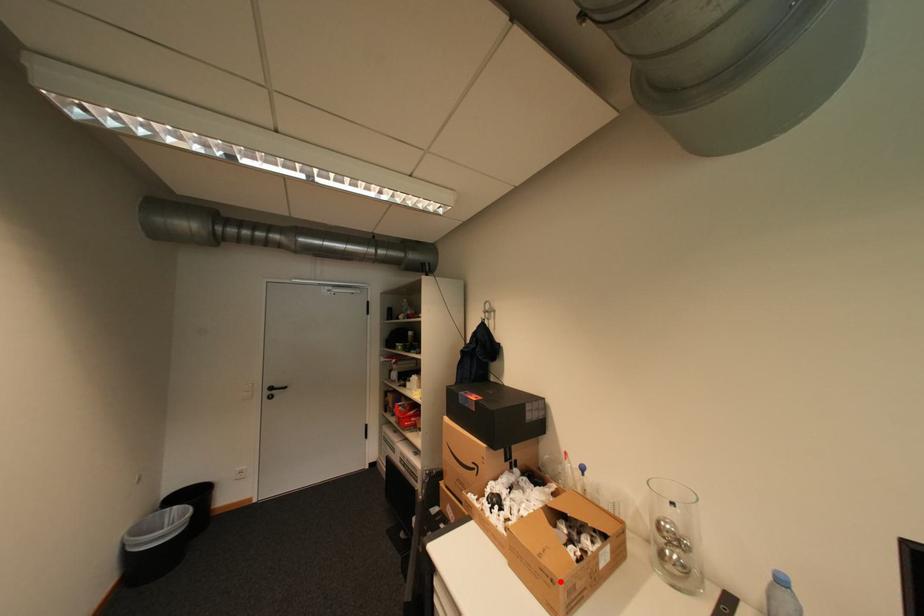
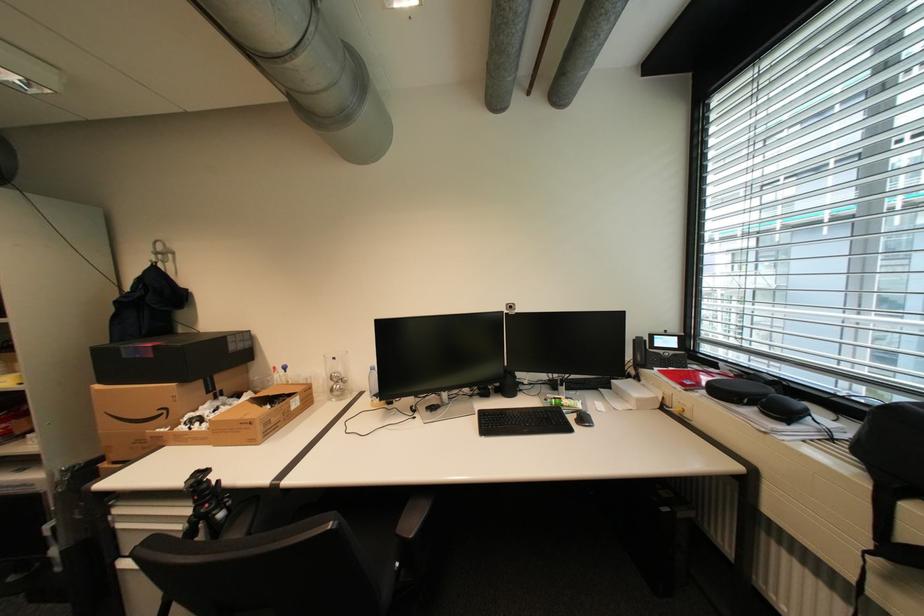
The point at the highlighted location is marked in the first image. Where is the corresponding point in the second image?

(259, 424)